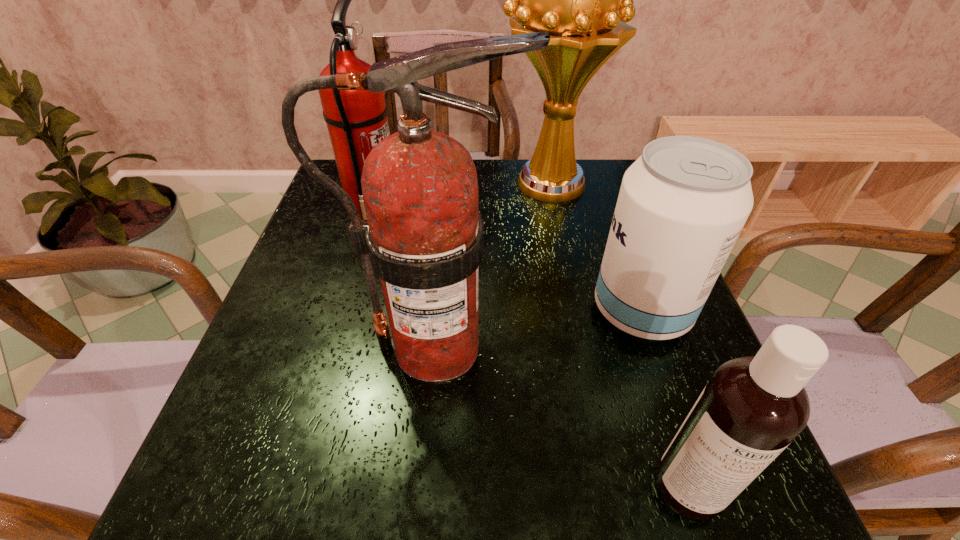
Locate an element on the screen. This screenshot has height=540, width=960. free space between the alcohol and the farther fire extinguisher is located at coordinates (508, 261).

Locate an element on the screen. vacant space in between the farther fire extinguisher and the alcohol is located at coordinates (508, 261).

The image size is (960, 540). Identify the location of vacant space that's between the nearer fire extinguisher and the alcohol. (539, 328).

Find the location of `vacant area between the trophy_cup and the alcohol`. vacant area between the trophy_cup and the alcohol is located at coordinates (594, 247).

Where is `vacant space in between the trophy_cup and the alcohol`? The height and width of the screenshot is (540, 960). vacant space in between the trophy_cup and the alcohol is located at coordinates (594, 247).

This screenshot has height=540, width=960. What are the coordinates of `the third closest object to the farther fire extinguisher` in the screenshot? It's located at (682, 204).

Identify the location of object identified as the closest to the dishwasher detergent. (682, 204).

Find the location of a particular element. The height and width of the screenshot is (540, 960). vacant region that satisfies the following two spatial constraints: 1. at the nozzle of the farther fire extinguisher; 2. on the left side of the alcohol is located at coordinates (347, 310).

I want to click on vacant space that satisfies the following two spatial constraints: 1. at the front of the trophy_cup where the globe is prominent; 2. on the back side of the alcohol, so click(x=574, y=310).